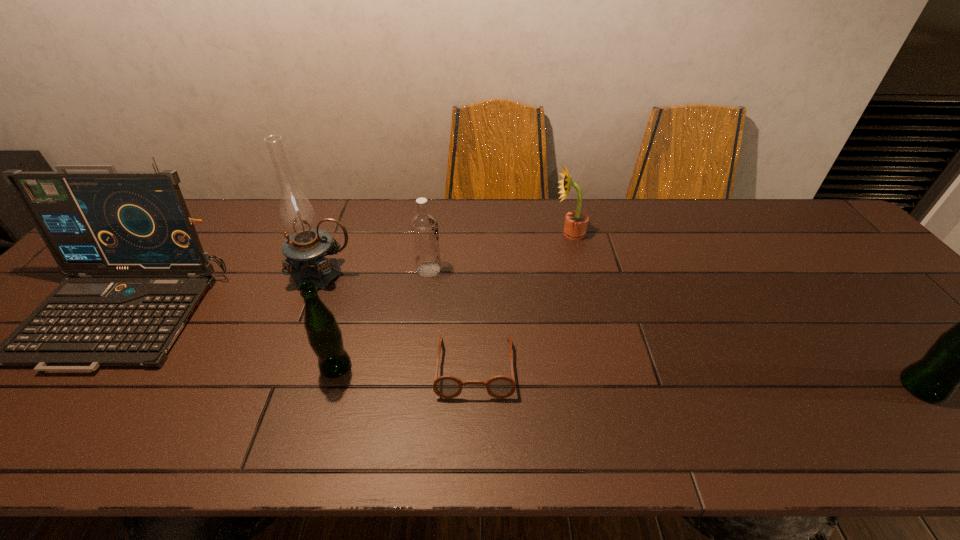
Identify the location of object that is the sixth closest to the sunflower. (94, 223).

Where is `object that is the second closest one to the rightmost object`? object that is the second closest one to the rightmost object is located at coordinates (447, 386).

Where is `vacant space that satisfies the following two spatial constraints: 1. on the face of the sunflower; 2. on the front-facing side of the third object from right to left`? This screenshot has width=960, height=540. vacant space that satisfies the following two spatial constraints: 1. on the face of the sunflower; 2. on the front-facing side of the third object from right to left is located at coordinates (602, 366).

What are the coordinates of `vacant space that satisfies the following two spatial constraints: 1. on the face of the farthest object; 2. on the back side of the taller beer bottle` in the screenshot? It's located at (x=607, y=387).